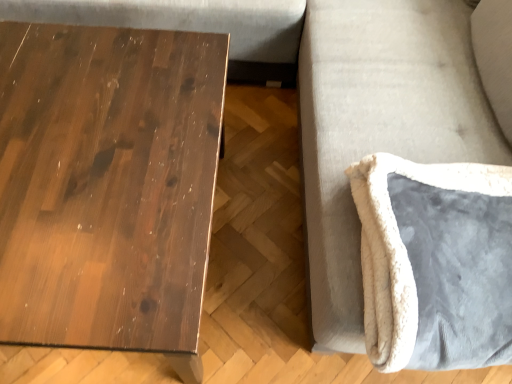
Question: Should I look upward or downward to see white plush cushion at lower right?

Choices:
 (A) up
 (B) down

Answer: (A)

Question: Is white plush cushion at lower right bigger than dark wood table at left?

Choices:
 (A) no
 (B) yes

Answer: (B)

Question: Is white plush cushion at lower right oriented away from dark wood table at left?

Choices:
 (A) yes
 (B) no

Answer: (B)

Question: Considering the relative sizes of white plush cushion at lower right and dark wood table at left in the image provided, is white plush cushion at lower right smaller than dark wood table at left?

Choices:
 (A) yes
 (B) no

Answer: (B)

Question: Considering the relative positions of white plush cushion at lower right and dark wood table at left in the image provided, is white plush cushion at lower right to the left of dark wood table at left from the viewer's perspective?

Choices:
 (A) yes
 (B) no

Answer: (B)

Question: Can you confirm if white plush cushion at lower right is thinner than dark wood table at left?

Choices:
 (A) no
 (B) yes

Answer: (B)

Question: Does white plush cushion at lower right come behind dark wood table at left?

Choices:
 (A) yes
 (B) no

Answer: (B)

Question: From a real-world perspective, is dark wood table at left located beneath white plush cushion at lower right?

Choices:
 (A) no
 (B) yes

Answer: (B)

Question: Considering the relative sizes of dark wood table at left and white plush cushion at lower right in the image provided, is dark wood table at left taller than white plush cushion at lower right?

Choices:
 (A) no
 (B) yes

Answer: (A)

Question: From the image's perspective, is dark wood table at left above white plush cushion at lower right?

Choices:
 (A) yes
 (B) no

Answer: (B)

Question: Is dark wood table at left closer to camera compared to white plush cushion at lower right?

Choices:
 (A) no
 (B) yes

Answer: (A)

Question: Can we say dark wood table at left lies outside white plush cushion at lower right?

Choices:
 (A) yes
 (B) no

Answer: (A)

Question: Can you confirm if dark wood table at left is shorter than white plush cushion at lower right?

Choices:
 (A) yes
 (B) no

Answer: (A)

Question: Considering the relative sizes of velvet gray swivel chair at right and white plush cushion at lower right in the image provided, is velvet gray swivel chair at right taller than white plush cushion at lower right?

Choices:
 (A) yes
 (B) no

Answer: (B)